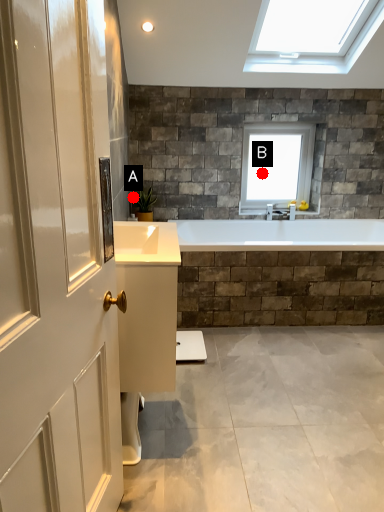
Question: Two points are circled on the image, labeled by A and B beside each circle. Which point appears closest to the camera in this image?

Choices:
 (A) A is closer
 (B) B is closer

Answer: (A)